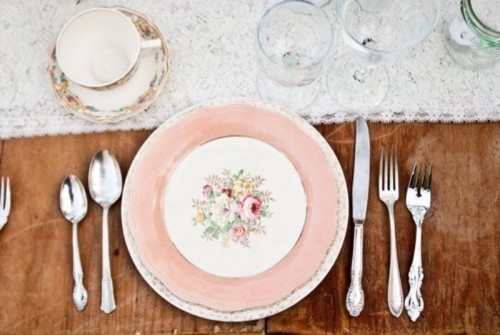
I want to click on utensils, so click(4, 207), click(85, 195), click(100, 164), click(364, 134), click(386, 184), click(420, 193).